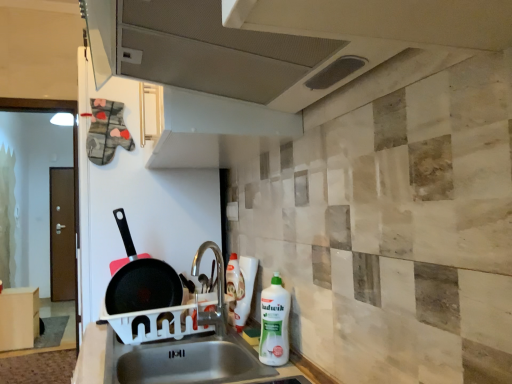
Describe the element at coordinates (99, 356) in the screenshot. I see `white plastic sink at lower center` at that location.

What do you see at coordinates (245, 290) in the screenshot? I see `white glossy bottle at center` at bounding box center [245, 290].

The image size is (512, 384). Describe the element at coordinates (274, 323) in the screenshot. I see `white plastic bottle at lower right` at that location.

Locate an element on the screen. metallic gray exhaust hood at upper center is located at coordinates (196, 48).

Where is `white plastic sink at lower center`? Image resolution: width=512 pixels, height=384 pixels. white plastic sink at lower center is located at coordinates (99, 356).

How different are the orientations of non-stick black frying pan at left and white plastic bottle at lower right in degrees?

95.5 degrees separate the facing orientations of non-stick black frying pan at left and white plastic bottle at lower right.

From a real-world perspective, relative to white plastic bottle at lower right, is non-stick black frying pan at left vertically above or below?

From a real-world perspective, non-stick black frying pan at left is physically above white plastic bottle at lower right.

Does non-stick black frying pan at left have a larger size compared to white plastic bottle at lower right?

Correct, non-stick black frying pan at left is larger in size than white plastic bottle at lower right.

How much distance is there between white glossy bottle at center and white plastic sink at lower center?

29.88 centimeters.

From a real-world perspective, is white glossy bottle at center over white plastic sink at lower center?

Yes.

Identify the location of bottle positioned vertically above the white plastic sink at lower center (from a real-world perspective). This screenshot has height=384, width=512. (245, 290).

Looking at this image, can you confirm if white glossy bottle at center is thinner than white plastic sink at lower center?

Yes.

From the image's perspective, which is below, light wood/wooden cabinet at lower left or white glossy bottle at center?

light wood/wooden cabinet at lower left, from the image's perspective.

Is light wood/wooden cabinet at lower left not within white glossy bottle at center?

That's correct, light wood/wooden cabinet at lower left is outside of white glossy bottle at center.

From a real-world perspective, is light wood/wooden cabinet at lower left positioned under white glossy bottle at center based on gravity?

Yes, from a real-world perspective, light wood/wooden cabinet at lower left is under white glossy bottle at center.

How many degrees apart are the facing directions of light wood/wooden cabinet at lower left and white glossy bottle at center?

They differ by 178 degrees in their facing directions.

Is light wood/wooden cabinet at lower left further to camera compared to metallic gray exhaust hood at upper center?

Yes, light wood/wooden cabinet at lower left is further from the camera.

From the image's perspective, is light wood/wooden cabinet at lower left under metallic gray exhaust hood at upper center?

Correct, light wood/wooden cabinet at lower left appears lower than metallic gray exhaust hood at upper center in the image.

From a real-world perspective, who is located lower, light wood/wooden cabinet at lower left or metallic gray exhaust hood at upper center?

light wood/wooden cabinet at lower left is physically lower.

Is point (263, 330) closer to viewer compared to point (144, 277)?

Yes.

How far apart are white plastic bottle at lower right and non-stick black frying pan at left?

white plastic bottle at lower right is 19.14 inches away from non-stick black frying pan at left.

Is white plastic bottle at lower right bigger than non-stick black frying pan at left?

Actually, white plastic bottle at lower right might be smaller than non-stick black frying pan at left.

How many degrees apart are the facing directions of white plastic bottle at lower right and non-stick black frying pan at left?

The angle between the facing direction of white plastic bottle at lower right and the facing direction of non-stick black frying pan at left is 95.5 degrees.

Is the surface of non-stick black frying pan at left in direct contact with light wood/wooden cabinet at lower left?

No, non-stick black frying pan at left is not with light wood/wooden cabinet at lower left.

Considering the points (121, 283) and (22, 345), which point is in front, point (121, 283) or point (22, 345)?

The point (121, 283) is more forward.

Can you tell me how much non-stick black frying pan at left and light wood/wooden cabinet at lower left differ in facing direction?

86.9 degrees.

Is the depth of white glossy bottle at center less than that of white plastic bottle at lower right?

No, the depth of white glossy bottle at center is greater than that of white plastic bottle at lower right.

Is white glossy bottle at center inside the boundaries of white plastic bottle at lower right, or outside?

white glossy bottle at center is outside white plastic bottle at lower right.

Is point (245, 289) positioned before point (273, 296)?

No, (245, 289) is further to viewer.

In order to click on frying pan on the left of white plastic bottle at lower right in this screenshot , I will do `click(141, 280)`.

This screenshot has height=384, width=512. Find the location of `bottle to the right of white plastic sink at lower center`. bottle to the right of white plastic sink at lower center is located at coordinates (245, 290).

Looking at the image, which one is located closer to light wood/wooden cabinet at lower left, white plastic sink at lower center or non-stick black frying pan at left?

Based on the image, non-stick black frying pan at left appears to be nearer to light wood/wooden cabinet at lower left.

In the scene shown: Estimate the real-world distances between objects in this image. Which object is further from white plastic bottle at lower right, white glossy bottle at center or white plastic sink at lower center?

Based on the image, white glossy bottle at center appears to be further to white plastic bottle at lower right.

When comparing their distances from white plastic sink at lower center, does metallic gray exhaust hood at upper center or non-stick black frying pan at left seem further?

The object further to white plastic sink at lower center is metallic gray exhaust hood at upper center.

When comparing their distances from white glossy bottle at center, does light wood/wooden cabinet at lower left or metallic gray exhaust hood at upper center seem further?

Based on the image, light wood/wooden cabinet at lower left appears to be further to white glossy bottle at center.

Which object lies nearer to the anchor point metallic gray exhaust hood at upper center, light wood/wooden cabinet at lower left or white plastic bottle at lower right?

white plastic bottle at lower right lies closer to metallic gray exhaust hood at upper center than the other object.

Estimate the real-world distances between objects in this image. Which object is closer to light wood/wooden cabinet at lower left, white plastic sink at lower center or white glossy bottle at center?

white plastic sink at lower center.

Considering their positions, is white plastic sink at lower center positioned closer to non-stick black frying pan at left than white plastic bottle at lower right?

Among the two, white plastic sink at lower center is located nearer to non-stick black frying pan at left.

From the image, which object appears to be farther from white plastic sink at lower center, metallic gray exhaust hood at upper center or white plastic bottle at lower right?

The object further to white plastic sink at lower center is metallic gray exhaust hood at upper center.

Identify the location of frying pan between metallic gray exhaust hood at upper center and white plastic sink at lower center vertically. (141, 280).

Find the location of a particular element. Image resolution: width=512 pixels, height=384 pixels. cleaning product positioned between white plastic sink at lower center and light wood/wooden cabinet at lower left from near to far is located at coordinates (274, 323).

I want to click on cleaning product between metallic gray exhaust hood at upper center and light wood/wooden cabinet at lower left from front to back, so click(274, 323).

This screenshot has width=512, height=384. Find the location of `frying pan located between white plastic sink at lower center and white glossy bottle at center in the depth direction`. frying pan located between white plastic sink at lower center and white glossy bottle at center in the depth direction is located at coordinates (141, 280).